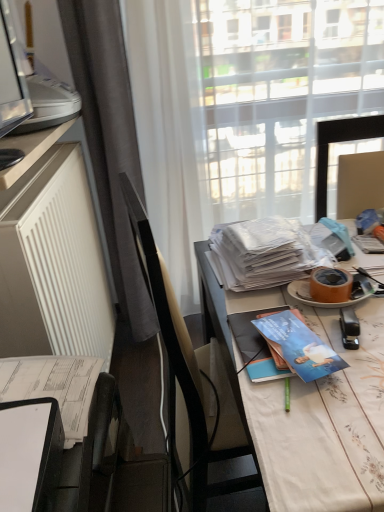
Question: Considering the relative sizes of white plastic printer at upper left and white matte radiator at left in the image provided, is white plastic printer at upper left bigger than white matte radiator at left?

Choices:
 (A) no
 (B) yes

Answer: (A)

Question: Can you confirm if white plastic printer at upper left is smaller than white matte radiator at left?

Choices:
 (A) no
 (B) yes

Answer: (B)

Question: Can you confirm if white plastic printer at upper left is shorter than white matte radiator at left?

Choices:
 (A) no
 (B) yes

Answer: (B)

Question: Is white plastic printer at upper left not near white matte radiator at left?

Choices:
 (A) no
 (B) yes

Answer: (A)

Question: Is white plastic printer at upper left turned away from white matte radiator at left?

Choices:
 (A) no
 (B) yes

Answer: (A)

Question: Based on their positions, is matte black monitor at left, positioned as the second desk in right-to-left order, located to the left or right of white glossy desk at center, which is the first desk in bottom-to-top order?

Choices:
 (A) left
 (B) right

Answer: (A)

Question: Which is correct: matte black monitor at left, marked as the first desk in a left-to-right arrangement, is inside white glossy desk at center, which ranks as the 1th desk in right-to-left order, or outside of it?

Choices:
 (A) inside
 (B) outside

Answer: (B)

Question: Considering the positions of point (8, 176) and point (230, 350), is point (8, 176) closer or farther from the camera than point (230, 350)?

Choices:
 (A) farther
 (B) closer

Answer: (A)

Question: Based on their sizes in the image, would you say matte black monitor at left, the 1th desk from the top, is bigger or smaller than white glossy desk at center, arranged as the second desk when viewed from the left?

Choices:
 (A) big
 (B) small

Answer: (B)

Question: Is translucent fabric at center inside or outside of white glossy desk at center, which ranks as the 1th desk in right-to-left order?

Choices:
 (A) outside
 (B) inside

Answer: (A)

Question: Visually, is translucent fabric at center positioned to the left or to the right of white glossy desk at center, the 2th desk viewed from the top?

Choices:
 (A) right
 (B) left

Answer: (B)

Question: Considering the positions of translucent fabric at center and white glossy desk at center, arranged as the second desk when viewed from the left, in the image, is translucent fabric at center bigger or smaller than white glossy desk at center, arranged as the second desk when viewed from the left,?

Choices:
 (A) small
 (B) big

Answer: (A)

Question: Looking at their shapes, would you say translucent fabric at center is wider or thinner than white glossy desk at center, arranged as the second desk when viewed from the left?

Choices:
 (A) wide
 (B) thin

Answer: (B)

Question: From a real-world perspective, is white glossy magazine at center, the 1th magazine when ordered from back to front, positioned above or below matte brown adhesive tape at right?

Choices:
 (A) above
 (B) below

Answer: (A)

Question: Is white glossy magazine at center, acting as the 1th magazine starting from the top, situated inside matte brown adhesive tape at right or outside?

Choices:
 (A) inside
 (B) outside

Answer: (B)